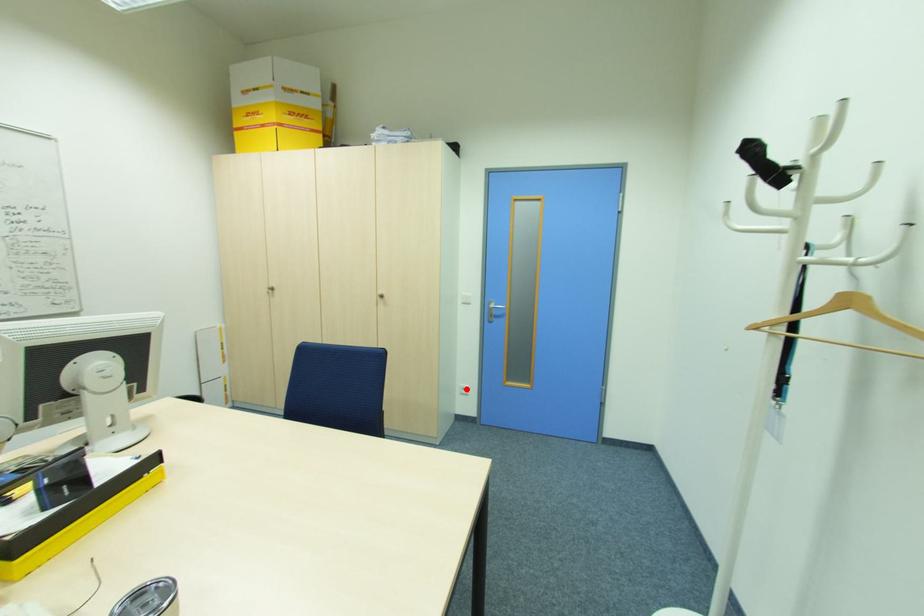
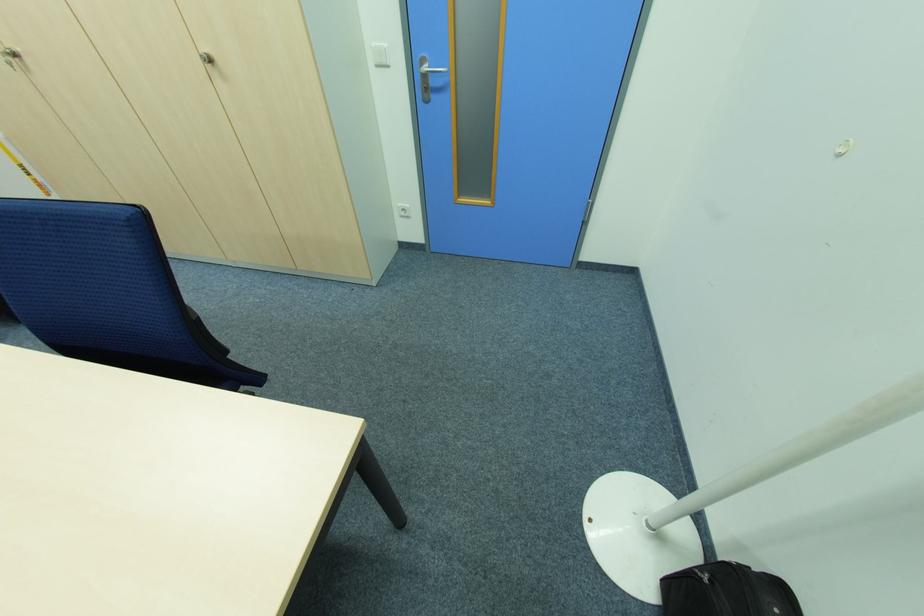
Question: I am providing you with two images of the same scene from different viewpoints. In image1, a red point is highlighted. Considering the same 3D point in image2, which of the following is correct?

Choices:
 (A) It is closer
 (B) It is farther

Answer: (A)